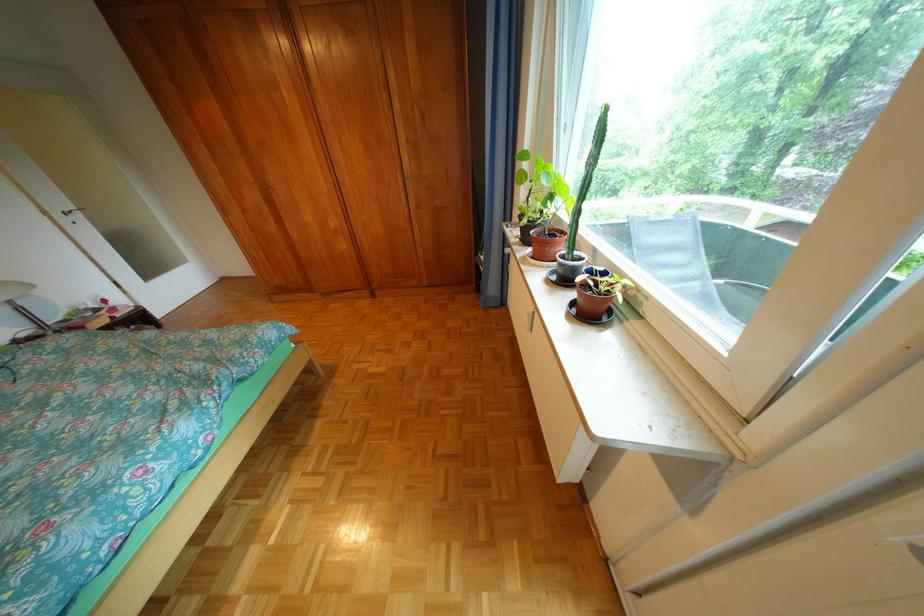
The height and width of the screenshot is (616, 924). Find the location of `silver wardrobe handle`. silver wardrobe handle is located at coordinates (529, 320).